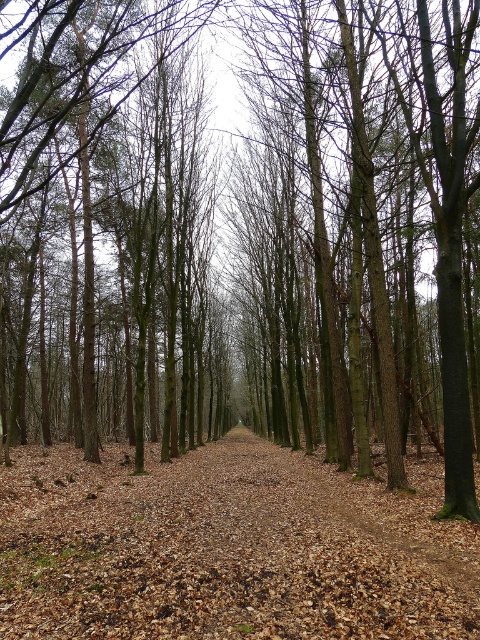
Consider the image. Does brown leafy trail at center have a lesser width compared to brown smooth tree at center?

Incorrect, brown leafy trail at center's width is not less than brown smooth tree at center's.

Who is higher up, brown leafy trail at center or brown smooth tree at center?

brown smooth tree at center is higher up.

Does point (108, 554) come closer to viewer compared to point (0, 220)?

Yes.

At what (x,y) coordinates should I click in order to perform the action: click on brown leafy trail at center. Please return your answer as a coordinate pair (x, y). Looking at the image, I should click on (228, 548).